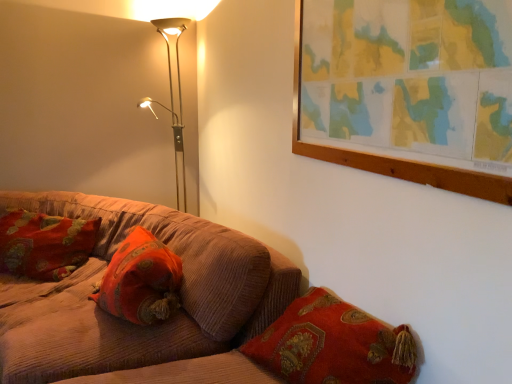
Question: Does velvet orange pillow at center, which is the 2th pillow in back-to-front order, have a greater height compared to corduroy couch at lower left?

Choices:
 (A) yes
 (B) no

Answer: (B)

Question: From the image's perspective, is velvet orange pillow at center, arranged as the first pillow when viewed from the front, beneath corduroy couch at lower left?

Choices:
 (A) no
 (B) yes

Answer: (A)

Question: From the image's perspective, is velvet orange pillow at center, marked as the second pillow in a left-to-right arrangement, on top of corduroy couch at lower left?

Choices:
 (A) no
 (B) yes

Answer: (B)

Question: Is there a large distance between velvet orange pillow at center, arranged as the first pillow when viewed from the front, and corduroy couch at lower left?

Choices:
 (A) no
 (B) yes

Answer: (A)

Question: Can you confirm if velvet orange pillow at center, marked as the second pillow in a left-to-right arrangement, is shorter than corduroy couch at lower left?

Choices:
 (A) yes
 (B) no

Answer: (A)

Question: Visually, is velvet cushion at left, placed as the 1th pillow when sorted from left to right, positioned to the left or to the right of velvet orange pillow at center, arranged as the first pillow when viewed from the front?

Choices:
 (A) left
 (B) right

Answer: (A)

Question: Considering the positions of velvet cushion at left, placed as the second pillow when sorted from front to back, and velvet orange pillow at center, the first pillow in the right-to-left sequence, in the image, is velvet cushion at left, placed as the second pillow when sorted from front to back, taller or shorter than velvet orange pillow at center, the first pillow in the right-to-left sequence,?

Choices:
 (A) short
 (B) tall

Answer: (B)

Question: Looking at the image, does velvet cushion at left, arranged as the 1th pillow when viewed from the back, seem bigger or smaller compared to velvet orange pillow at center, which is the 2th pillow in back-to-front order?

Choices:
 (A) small
 (B) big

Answer: (B)

Question: From a real-world perspective, is velvet cushion at left, arranged as the 1th pillow when viewed from the back, above or below velvet orange pillow at center, the first pillow in the right-to-left sequence?

Choices:
 (A) above
 (B) below

Answer: (A)

Question: Considering the positions of metallic floor lamp at upper left and velvet orange pillow at center, arranged as the first pillow when viewed from the front, in the image, is metallic floor lamp at upper left taller or shorter than velvet orange pillow at center, arranged as the first pillow when viewed from the front,?

Choices:
 (A) short
 (B) tall

Answer: (B)

Question: From the image's perspective, is metallic floor lamp at upper left located above or below velvet orange pillow at center, which is the 2th pillow in back-to-front order?

Choices:
 (A) above
 (B) below

Answer: (A)

Question: In terms of size, does metallic floor lamp at upper left appear bigger or smaller than velvet orange pillow at center, which is the 2th pillow in back-to-front order?

Choices:
 (A) small
 (B) big

Answer: (B)

Question: From a real-world perspective, is metallic floor lamp at upper left physically located above or below velvet orange pillow at center, marked as the second pillow in a left-to-right arrangement?

Choices:
 (A) above
 (B) below

Answer: (A)

Question: Is corduroy couch at lower left inside or outside of velvet orange pillow at center, arranged as the first pillow when viewed from the front?

Choices:
 (A) outside
 (B) inside

Answer: (A)

Question: Considering the positions of corduroy couch at lower left and velvet orange pillow at center, which is the 2th pillow in back-to-front order, in the image, is corduroy couch at lower left wider or thinner than velvet orange pillow at center, which is the 2th pillow in back-to-front order,?

Choices:
 (A) thin
 (B) wide

Answer: (B)